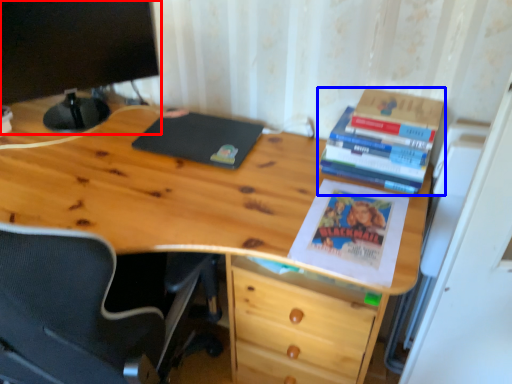
Question: Which of the following is the farthest to the observer, computer monitor (highlighted by a red box) or book (highlighted by a blue box)?

Choices:
 (A) computer monitor
 (B) book

Answer: (A)